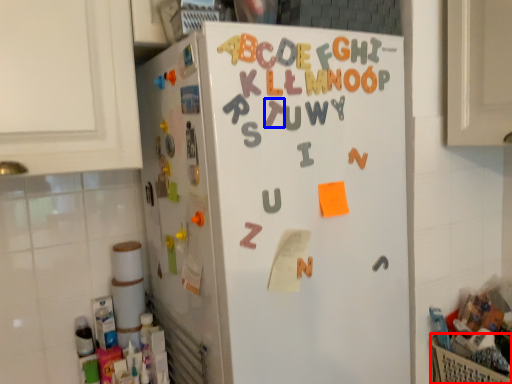
Question: Which point is closer to the camera, basket (highlighted by a red box) or letter (highlighted by a blue box)?

Choices:
 (A) basket
 (B) letter

Answer: (B)